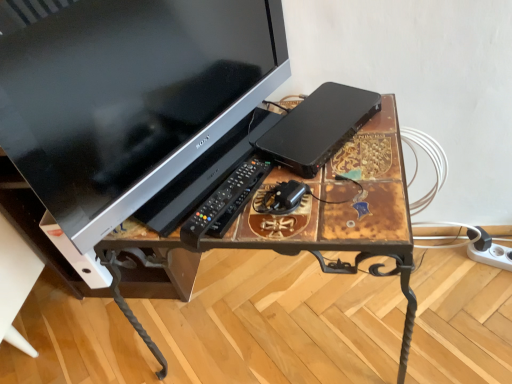
Question: Considering the relative positions of black plastic power adapter at center and white plastic extension cord at lower right in the image provided, is black plastic power adapter at center in front of white plastic extension cord at lower right?

Choices:
 (A) yes
 (B) no

Answer: (A)

Question: Does black plastic power adapter at center lie behind white plastic extension cord at lower right?

Choices:
 (A) yes
 (B) no

Answer: (B)

Question: Is black plastic power adapter at center wider than white plastic extension cord at lower right?

Choices:
 (A) yes
 (B) no

Answer: (B)

Question: Does black plastic power adapter at center appear on the left side of white plastic extension cord at lower right?

Choices:
 (A) yes
 (B) no

Answer: (A)

Question: Is black plastic power adapter at center thinner than white plastic extension cord at lower right?

Choices:
 (A) no
 (B) yes

Answer: (B)

Question: From the image's perspective, is black plastic remote at center positioned above or below white plastic extension cord at lower right?

Choices:
 (A) below
 (B) above

Answer: (B)

Question: Is black plastic remote at center in front of or behind white plastic extension cord at lower right in the image?

Choices:
 (A) front
 (B) behind

Answer: (A)

Question: Is black plastic remote at center spatially inside white plastic extension cord at lower right, or outside of it?

Choices:
 (A) inside
 (B) outside

Answer: (B)

Question: Considering the positions of black plastic remote at center and white plastic extension cord at lower right in the image, is black plastic remote at center bigger or smaller than white plastic extension cord at lower right?

Choices:
 (A) small
 (B) big

Answer: (A)

Question: In the image, is black plastic computer at center positioned in front of or behind white plastic extension cord at lower right?

Choices:
 (A) front
 (B) behind

Answer: (A)

Question: Does point (283, 134) appear closer or farther from the camera than point (476, 259)?

Choices:
 (A) closer
 (B) farther

Answer: (A)

Question: From a real-world perspective, is black plastic computer at center physically located above or below white plastic extension cord at lower right?

Choices:
 (A) below
 (B) above

Answer: (B)

Question: In the image, is black plastic computer at center on the left side or the right side of white plastic extension cord at lower right?

Choices:
 (A) left
 (B) right

Answer: (A)

Question: From their relative heights in the image, would you say black plastic computer at center is taller or shorter than black plastic power adapter at center?

Choices:
 (A) short
 (B) tall

Answer: (B)

Question: From the image's perspective, relative to black plastic power adapter at center, is black plastic computer at center above or below?

Choices:
 (A) below
 (B) above

Answer: (B)